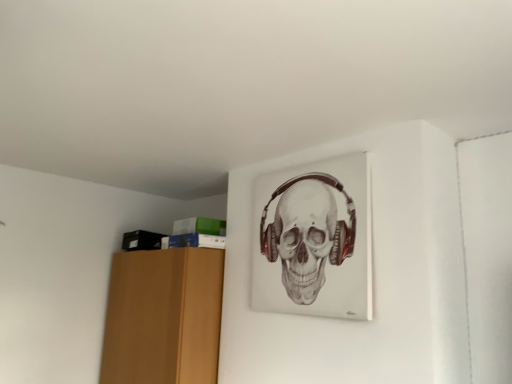
In order to face gray matte skull at upper center, should I rotate leftwards or rightwards?

It's best to rotate right around 6.568 degrees.

Describe the element at coordinates (307, 233) in the screenshot. This screenshot has width=512, height=384. I see `gray matte skull at upper center` at that location.

This screenshot has width=512, height=384. In order to click on gray matte skull at upper center in this screenshot , I will do `click(307, 233)`.

Where is `gray matte skull at upper center`? The image size is (512, 384). gray matte skull at upper center is located at coordinates (307, 233).